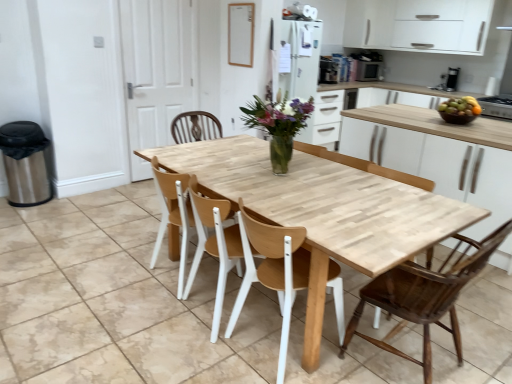
This screenshot has height=384, width=512. What are the coordinates of `matte black microwave at upper right, the 1th appliance positioned from the back` in the screenshot? It's located at (368, 70).

Measure the distance between metallic silver toaster at upper center, which is the 2th appliance from back to front, and camera.

metallic silver toaster at upper center, which is the 2th appliance from back to front, and camera are 20.08 feet apart.

Describe the element at coordinates (328, 70) in the screenshot. I see `metallic silver toaster at upper center, the second appliance in the bottom-to-top sequence` at that location.

In order to face dark brown wood chair at center, which is the third chair in left-to-right order, should I rotate leftwards or rightwards?

To align with it, rotate right about 21.931°.

I want to click on dark brown wood chair at center, acting as the first chair starting from the right, so click(425, 295).

At what (x,y) coordinates should I click in order to perform the action: click on matte black microwave at upper right, which is the 3th appliance in bottom-to-top order. Please return your answer as a coordinate pair (x, y). The image size is (512, 384). Looking at the image, I should click on (368, 70).

Considering the positions of objects translucent glass vase at center and dark brown wood chair at center, which is the third chair in left-to-right order, in the image provided, who is more to the left, translucent glass vase at center or dark brown wood chair at center, which is the third chair in left-to-right order,?

From the viewer's perspective, translucent glass vase at center appears more on the left side.

Are translucent glass vase at center and dark brown wood chair at center, acting as the first chair starting from the right, far apart?

Yes, translucent glass vase at center and dark brown wood chair at center, acting as the first chair starting from the right, are quite far apart.

Which object is thinner, translucent glass vase at center or dark brown wood chair at center, which is the third chair in left-to-right order?

With smaller width is translucent glass vase at center.

Which is nearer, (280, 153) or (426, 282)?

The point (426, 282) is closer.

Considering the positions of objects metallic silver toaster at upper center, marked as the first appliance in a left-to-right arrangement, and light wood table at center in the image provided, who is more to the left, metallic silver toaster at upper center, marked as the first appliance in a left-to-right arrangement, or light wood table at center?

From the viewer's perspective, light wood table at center appears more on the left side.

Is metallic silver toaster at upper center, the second appliance in the bottom-to-top sequence, touching light wood table at center?

No, metallic silver toaster at upper center, the second appliance in the bottom-to-top sequence, is not in contact with light wood table at center.

Could you tell me if metallic silver toaster at upper center, acting as the second appliance starting from the front, is facing light wood table at center?

No, metallic silver toaster at upper center, acting as the second appliance starting from the front, is not facing towards light wood table at center.

Is point (334, 67) farther from camera compared to point (318, 230)?

Yes, point (334, 67) is behind point (318, 230).

Based on the photo, is light wood table at center positioned far away from shiny brown bowl at right?

Yes, light wood table at center and shiny brown bowl at right are quite far apart.

Between light wood table at center and shiny brown bowl at right, which one appears on the right side from the viewer's perspective?

shiny brown bowl at right is more to the right.

Which is correct: light wood table at center is inside shiny brown bowl at right, or outside of it?

light wood table at center lies outside shiny brown bowl at right.

Looking at their sizes, would you say light wood table at center is wider or thinner than shiny brown bowl at right?

Considering their sizes, light wood table at center looks broader than shiny brown bowl at right.

Is metallic silver toaster at upper center, acting as the second appliance starting from the front, far away from matte black microwave at upper right, the second appliance from the right?

No, there isn't a large distance between metallic silver toaster at upper center, acting as the second appliance starting from the front, and matte black microwave at upper right, the second appliance from the right.

Which object is closer to the camera, metallic silver toaster at upper center, which is the 2th appliance from back to front, or matte black microwave at upper right, the 3th appliance viewed from the front?

metallic silver toaster at upper center, which is the 2th appliance from back to front, is in front.

In the scene shown: Between metallic silver toaster at upper center, marked as the second appliance in a top-to-bottom arrangement, and matte black microwave at upper right, the 1th appliance positioned from the back, which one has larger size?

matte black microwave at upper right, the 1th appliance positioned from the back, is bigger.

Starting from the metallic silver toaster at upper center, which is the 2th appliance from back to front, which appliance is the 1st one to the right? Please provide its 2D coordinates.

[(368, 70)]

From the image's perspective, which is above, wooden at center, the second chair viewed from the left, or translucent glass vase at center?

From the image's view, translucent glass vase at center is above.

Locate an element on the screen. floral arrangement that appears above the wooden at center, the second chair viewed from the right (from a real-world perspective) is located at coordinates (279, 125).

Between wooden at center, the second chair viewed from the right, and translucent glass vase at center, which one appears on the left side from the viewer's perspective?

wooden at center, the second chair viewed from the right.

Is wooden at center, the second chair viewed from the right, further to camera compared to matte black microwave at upper right, the 1th appliance from the top?

No, it is not.

From a real-world perspective, is wooden at center, the second chair viewed from the right, physically below matte black microwave at upper right, the second appliance from the left?

Yes, from a real-world perspective, wooden at center, the second chair viewed from the right, is beneath matte black microwave at upper right, the second appliance from the left.

Do you think wooden at center, the second chair viewed from the right, is within matte black microwave at upper right, the 1th appliance positioned from the back, or outside of it?

The correct answer is: outside.

Which is behind, point (267, 282) or point (382, 64)?

Point (382, 64)

Considering the sizes of objects white matte cabinet at upper right and metallic silver stove at right, acting as the 1th appliance starting from the bottom, in the image provided, who is shorter, white matte cabinet at upper right or metallic silver stove at right, acting as the 1th appliance starting from the bottom,?

metallic silver stove at right, acting as the 1th appliance starting from the bottom, is shorter.

Is white matte cabinet at upper right wider than metallic silver stove at right, the third appliance from the top?

No, white matte cabinet at upper right is not wider than metallic silver stove at right, the third appliance from the top.

From a real-world perspective, does white matte cabinet at upper right stand above metallic silver stove at right, which appears as the 1th appliance when viewed from the front?

Yes, from a real-world perspective, white matte cabinet at upper right is on top of metallic silver stove at right, which appears as the 1th appliance when viewed from the front.

Where is `floral arrangement above the dark brown wood chair at center, which is the third chair in left-to-right order (from the image's perspective)`? floral arrangement above the dark brown wood chair at center, which is the third chair in left-to-right order (from the image's perspective) is located at coordinates (279, 125).

Which appliance is the 1st one when counting from the right side of the light wood table at center? Please provide its 2D coordinates.

[(328, 70)]

When comparing their distances from matte black microwave at upper right, the second appliance from the right, does light wood table at center or shiny brown bowl at right seem further?

light wood table at center lies further to matte black microwave at upper right, the second appliance from the right, than the other object.

Which object lies further to the anchor point white matte cabinet at upper right, shiny brown bowl at right or metallic silver stove at right, which appears as the first appliance when viewed from the right?

shiny brown bowl at right is further to white matte cabinet at upper right.

Considering their positions, is wooden at center, the third chair viewed from the right, positioned closer to light wood table at center than white matte cabinet at upper right?

Based on the image, wooden at center, the third chair viewed from the right, appears to be nearer to light wood table at center.

Looking at the image, which one is located closer to matte black microwave at upper right, the second appliance from the right, metallic silver stove at right, acting as the 1th appliance starting from the bottom, or shiny brown bowl at right?

metallic silver stove at right, acting as the 1th appliance starting from the bottom.

Estimate the real-world distances between objects in this image. Which object is further from wooden at center, which ranks as the 1th chair in left-to-right order, light wood table at center or metallic silver stove at right, the third appliance viewed from the back?

metallic silver stove at right, the third appliance viewed from the back, is positioned further to the anchor wooden at center, which ranks as the 1th chair in left-to-right order.

Estimate the real-world distances between objects in this image. Which object is closer to metallic silver toaster at upper center, acting as the second appliance starting from the front, shiny brown bowl at right or wooden at center, the second chair viewed from the right?

Based on the image, shiny brown bowl at right appears to be nearer to metallic silver toaster at upper center, acting as the second appliance starting from the front.

Considering their positions, is translucent glass vase at center positioned closer to metallic silver stove at right, acting as the 1th appliance starting from the bottom, than shiny brown bowl at right?

shiny brown bowl at right.

Estimate the real-world distances between objects in this image. Which object is further from wooden at center, which ranks as the 1th chair in left-to-right order, metallic silver toaster at upper center, acting as the second appliance starting from the front, or metallic silver stove at right, which appears as the first appliance when viewed from the right?

The object further to wooden at center, which ranks as the 1th chair in left-to-right order, is metallic silver toaster at upper center, acting as the second appliance starting from the front.

Locate an element on the screen. chair between translucent glass vase at center and wooden at center, the second chair viewed from the right, vertically is located at coordinates (175, 213).

Find the location of `appliance between wooden at center, the second chair viewed from the right, and metallic silver toaster at upper center, the second appliance in the bottom-to-top sequence, along the z-axis`. appliance between wooden at center, the second chair viewed from the right, and metallic silver toaster at upper center, the second appliance in the bottom-to-top sequence, along the z-axis is located at coordinates [497, 106].

The height and width of the screenshot is (384, 512). Find the location of `fruit between dark brown wood chair at center, acting as the first chair starting from the right, and metallic silver stove at right, which is the third appliance in left-to-right order, along the z-axis`. fruit between dark brown wood chair at center, acting as the first chair starting from the right, and metallic silver stove at right, which is the third appliance in left-to-right order, along the z-axis is located at coordinates [461, 106].

Identify the location of floral arrangement between wooden at center, the second chair viewed from the right, and metallic silver stove at right, acting as the 1th appliance starting from the bottom, in the horizontal direction. click(279, 125).